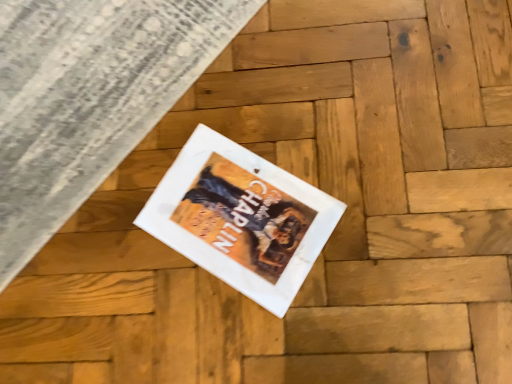
Where is `free space in front of white matte picture frame at center`? free space in front of white matte picture frame at center is located at coordinates (304, 320).